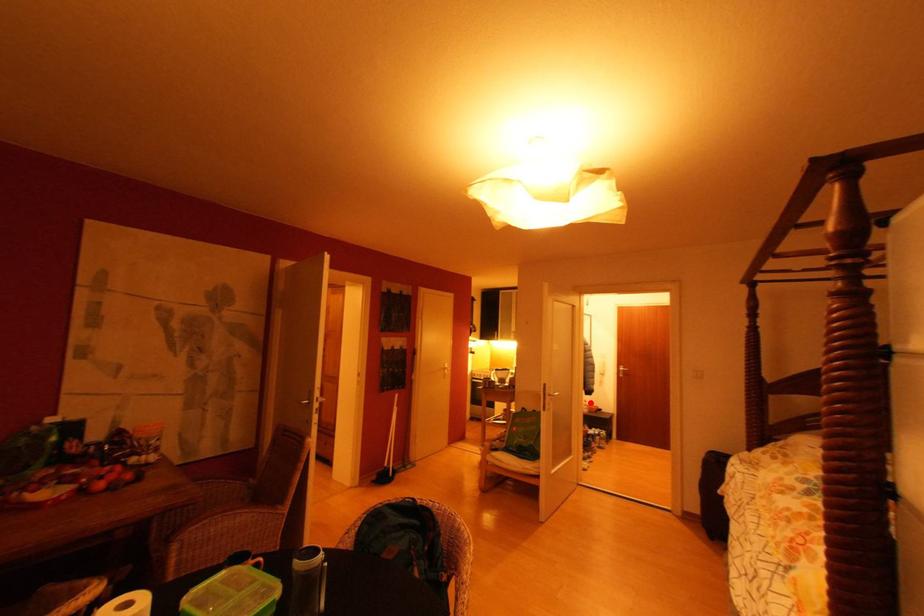
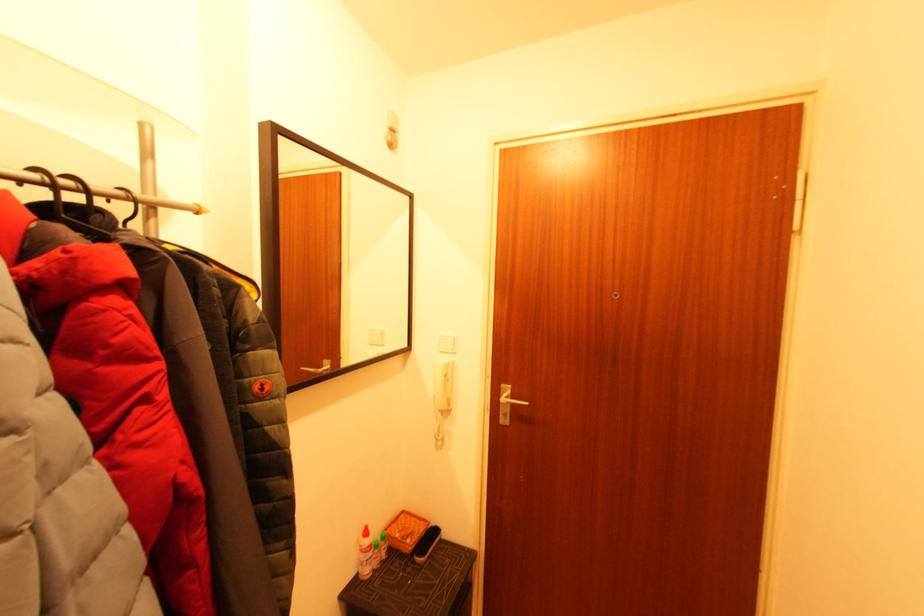
Question: I am providing you with two images of the same scene from different viewpoints. In image1, a red point is highlighted. Considering the same 3D point in image2, which of the following is correct?

Choices:
 (A) It is closer
 (B) It is farther

Answer: (A)